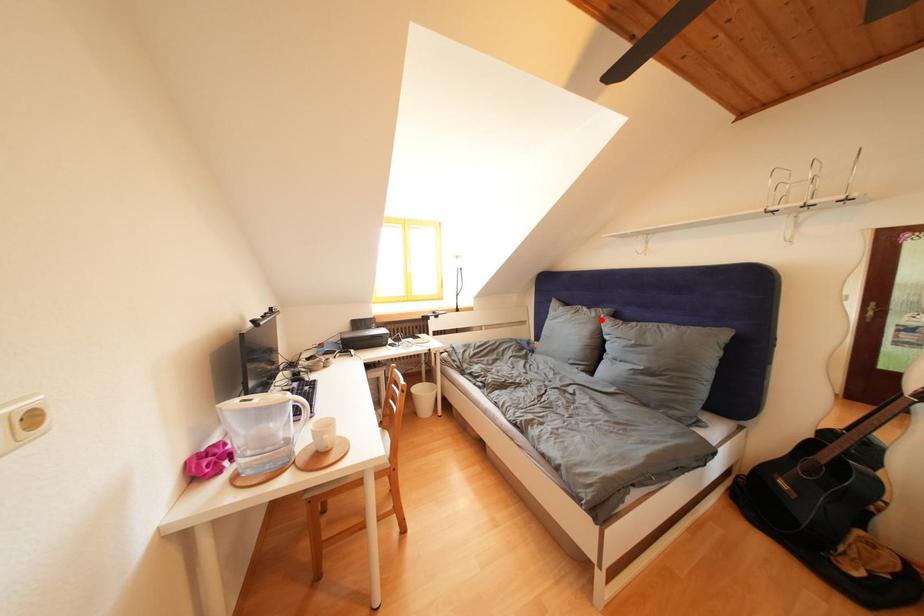
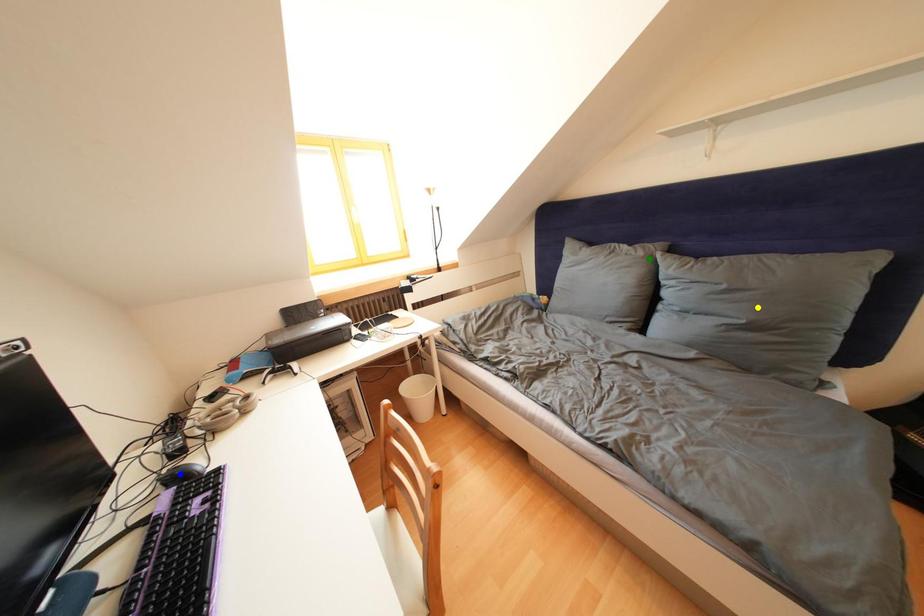
Question: I am providing you with two images of the same scene from different viewpoints. A red point is marked on the first image. You are given multiple points on the second image. Can you choose the point in image 2 that corresponds to the point in image 1?

Choices:
 (A) blue point
 (B) green point
 (C) yellow point

Answer: (B)